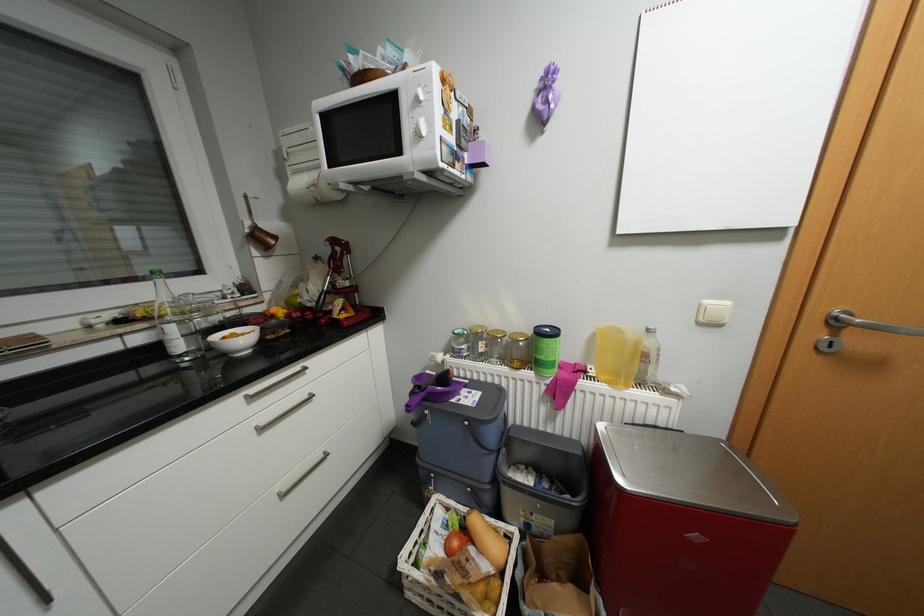
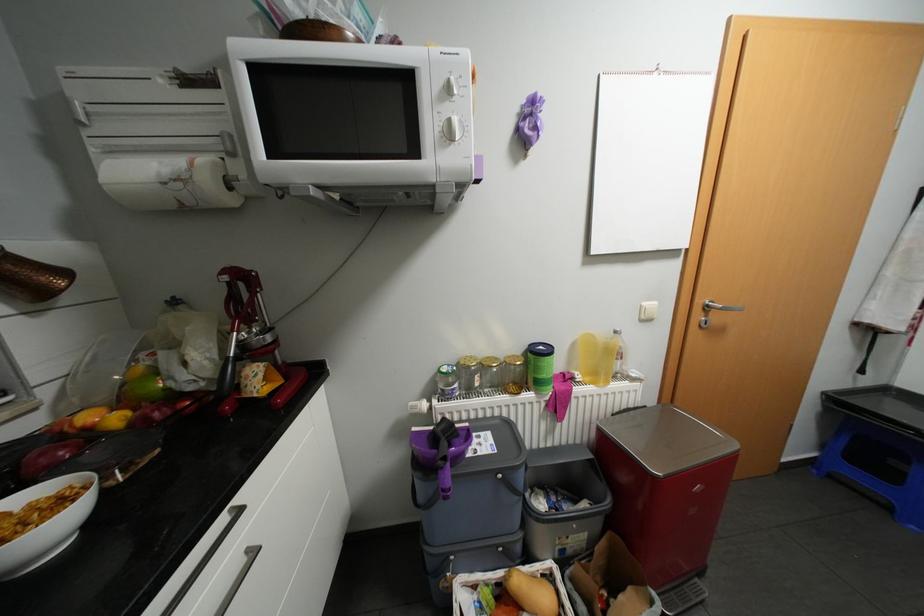
The point at (x=600, y=371) is marked in the first image. Where is the corresponding point in the second image?

(587, 377)